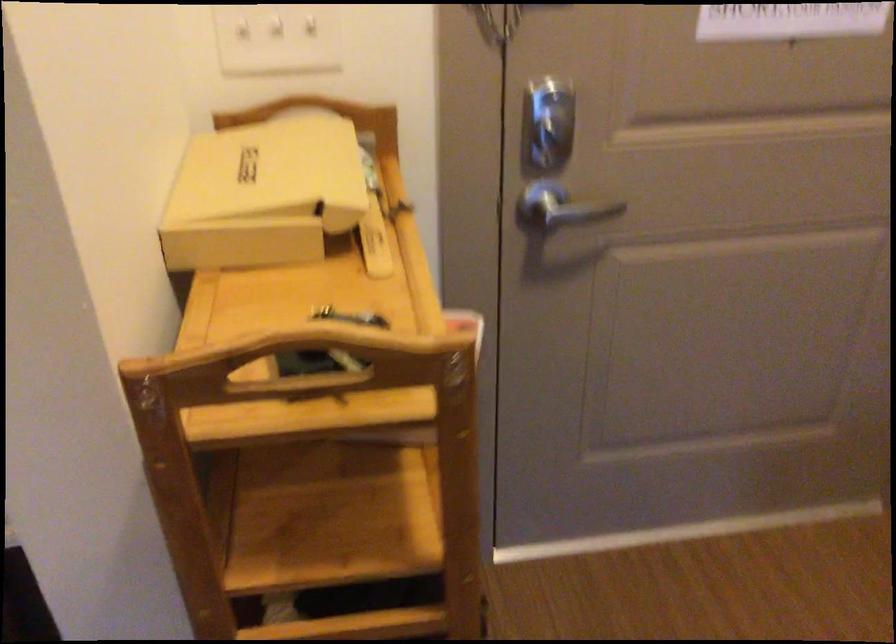
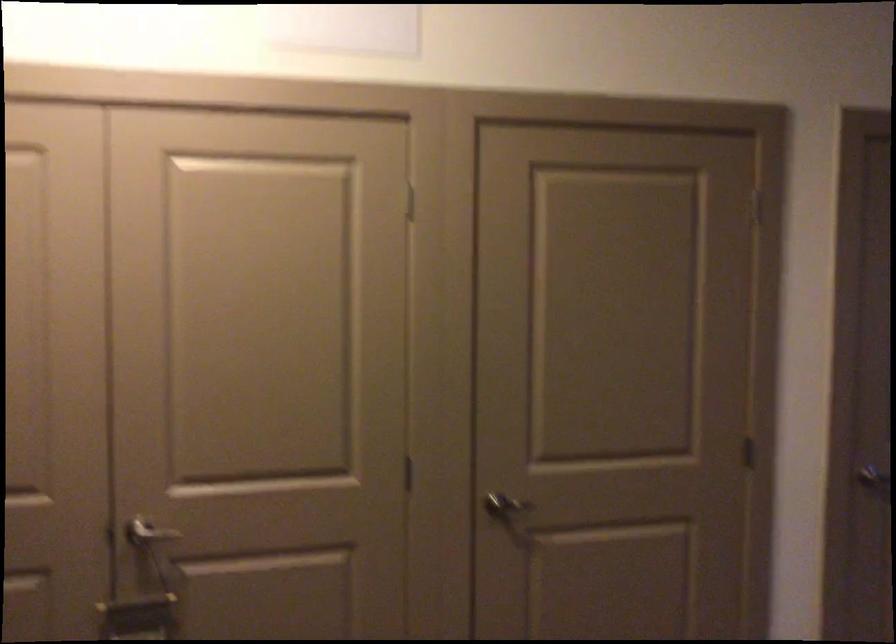
Question: The images are taken continuously from a first-person perspective. In which direction is your viewpoint rotating?

Choices:
 (A) Left
 (B) Right
 (C) Up
 (D) Down

Answer: (B)